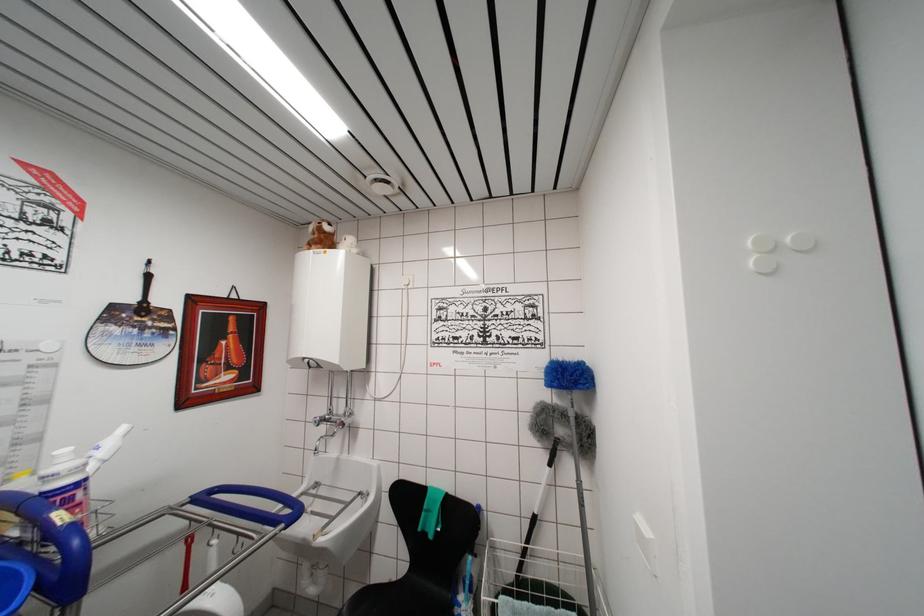
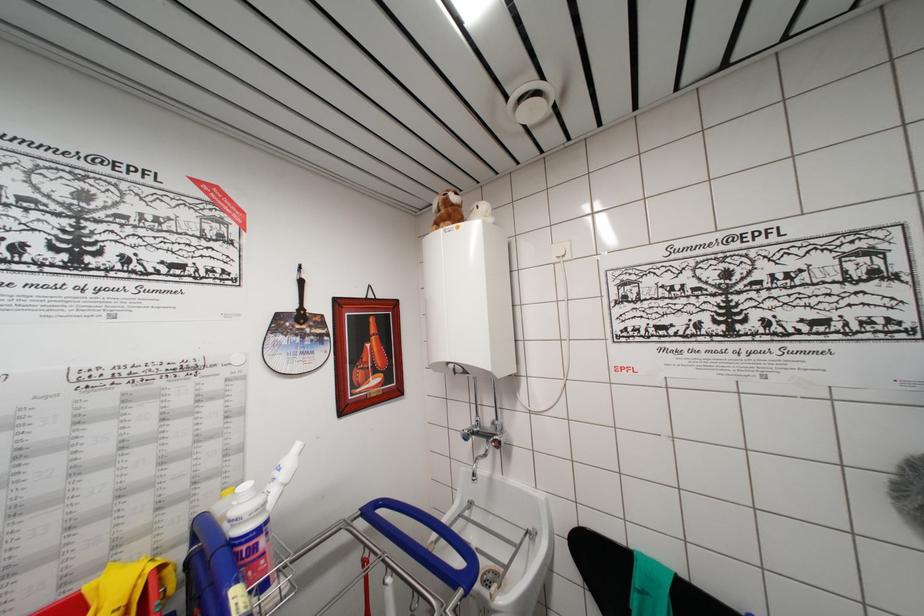
In the scene shown: In a continuous first-person perspective shot, in which direction is the camera moving?

The cameraman moved toward left, forward.